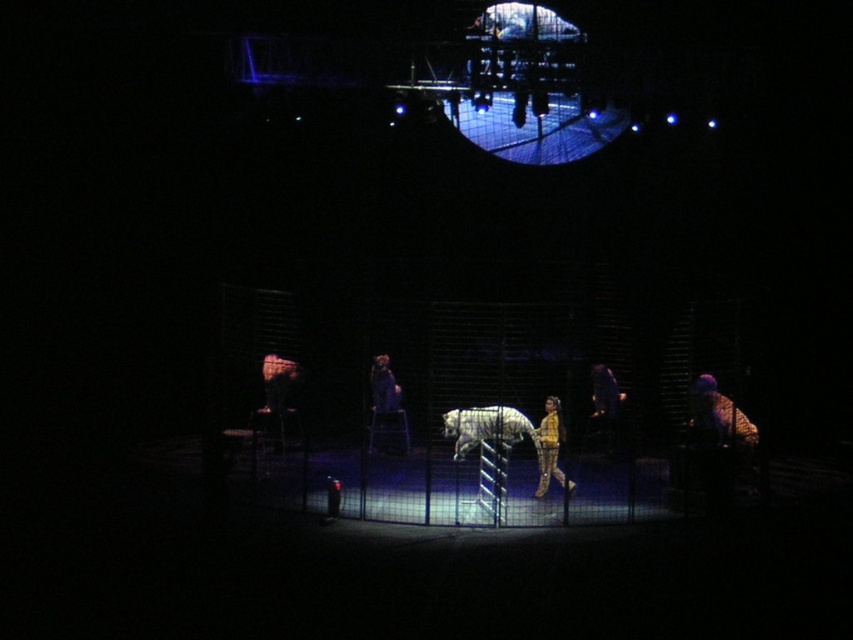
Which is behind, point (747, 428) or point (380, 355)?

Positioned behind is point (380, 355).

Which is above, shiny purple bird at right or dark blue fabric at center?

dark blue fabric at center is above.

Between point (712, 410) and point (387, 392), which one is positioned behind?

The point (387, 392) is more distant.

Where is `shiny purple bird at right`? shiny purple bird at right is located at coordinates (718, 413).

How much distance is there between yellow fabric person at center and dark blue fabric at center?

A distance of 6.94 feet exists between yellow fabric person at center and dark blue fabric at center.

Does point (558, 472) come in front of point (370, 369)?

Yes, it is in front of point (370, 369).

Where is `yellow fabric person at center`? This screenshot has width=853, height=640. yellow fabric person at center is located at coordinates (550, 448).

Is white fur tiger at center shorter than dark blue fabric at center?

Correct, white fur tiger at center is not as tall as dark blue fabric at center.

Does white fur tiger at center have a smaller size compared to dark blue fabric at center?

Actually, white fur tiger at center might be larger than dark blue fabric at center.

Does point (444, 435) come in front of point (399, 408)?

That is True.

Find the location of `white fur tiger at center`. white fur tiger at center is located at coordinates (486, 428).